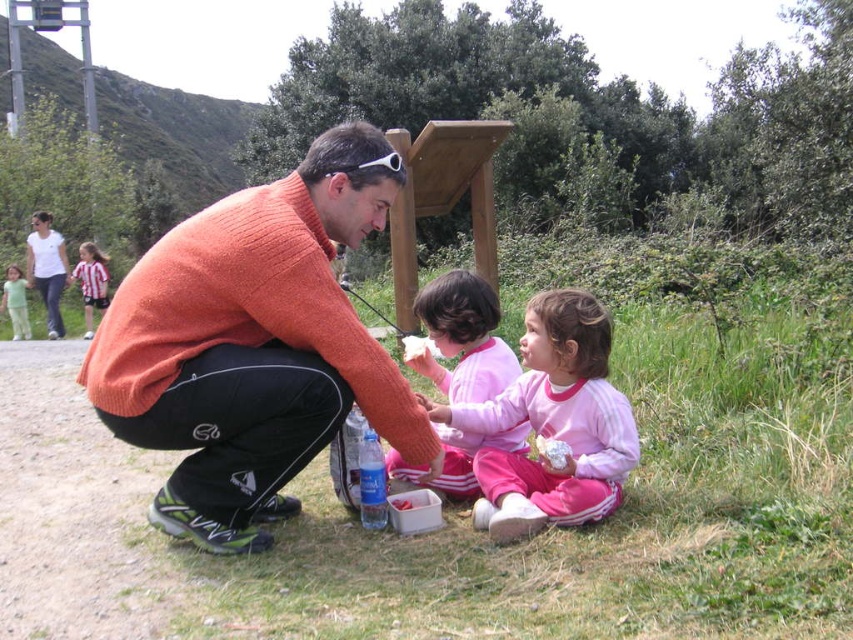
Question: Which point is farther to the camera?

Choices:
 (A) pos(21,285)
 (B) pos(86,310)
 (C) pos(54,257)

Answer: (A)

Question: Can you confirm if pink fleece jacket at center is positioned to the right of striped jersey at upper left?

Choices:
 (A) yes
 (B) no

Answer: (A)

Question: Which object appears farthest from the camera in this image?

Choices:
 (A) orange sweater at center
 (B) light green fabric pants at lower left
 (C) orange knitted sweater at center
 (D) white paper napkin at center

Answer: (B)

Question: Is orange knitted sweater at center wider than white plastic bag at lower center?

Choices:
 (A) yes
 (B) no

Answer: (A)

Question: Does pink fleece jacket at lower center come in front of white paper napkin at center?

Choices:
 (A) yes
 (B) no

Answer: (A)

Question: Which object is closer to the camera taking this photo?

Choices:
 (A) striped jersey at upper left
 (B) white paper napkin at center
 (C) pink fleece jacket at lower center
 (D) orange sweater at center

Answer: (C)